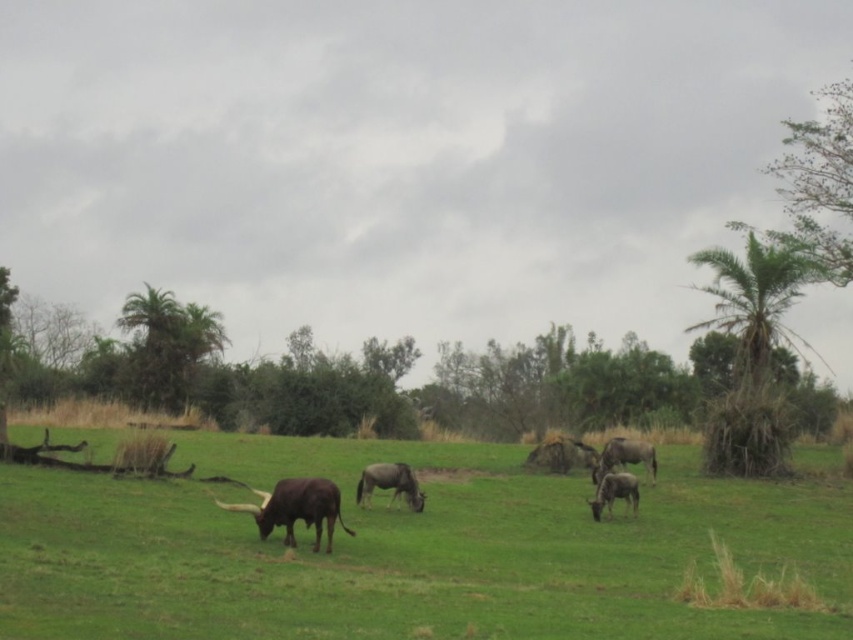
Question: Estimate the real-world distances between objects in this image. Which object is farther from the brown glossy antelope at center-right?

Choices:
 (A) gray matte/glossy wildebeest at center
 (B) green grass pasture at center

Answer: (B)

Question: Can you confirm if green leafy palm at right is bigger than brown glossy antelope at center?

Choices:
 (A) no
 (B) yes

Answer: (B)

Question: Can you confirm if brown glossy antelope at center-right is wider than gray matte/glossy wildebeest at center?

Choices:
 (A) no
 (B) yes

Answer: (A)

Question: Which point is farther to the camera?

Choices:
 (A) (619, 448)
 (B) (593, 508)
 (C) (415, 493)
 (D) (616, 589)

Answer: (A)

Question: Does green grass pasture at center appear on the left side of green leafy palm at right?

Choices:
 (A) no
 (B) yes

Answer: (B)

Question: Which object appears farthest from the camera in this image?

Choices:
 (A) green grass pasture at center
 (B) brown glossy antelope at center-right

Answer: (B)